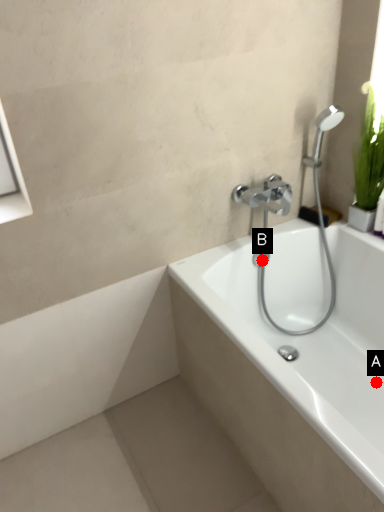
Question: Two points are circled on the image, labeled by A and B beside each circle. Which point is closer to the camera?

Choices:
 (A) A is closer
 (B) B is closer

Answer: (A)